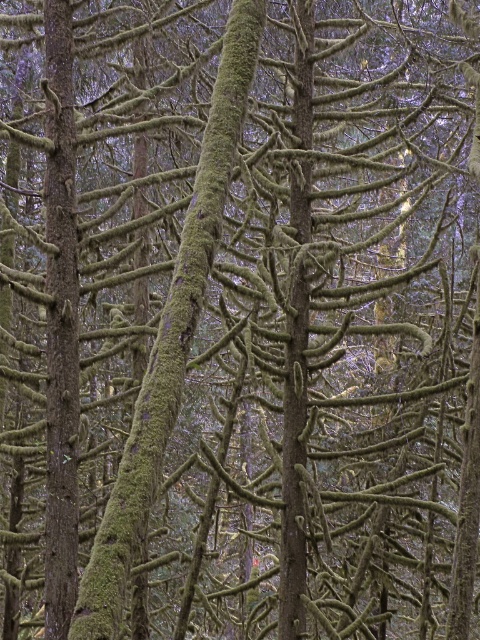
How distant is green mossy tree trunk at center from green mossy tree trunk at left?

A distance of 8.62 feet exists between green mossy tree trunk at center and green mossy tree trunk at left.

Is green mossy tree trunk at center to the right of green mossy tree trunk at left from the viewer's perspective?

Correct, you'll find green mossy tree trunk at center to the right of green mossy tree trunk at left.

Locate an element on the screen. The width and height of the screenshot is (480, 640). green mossy tree trunk at center is located at coordinates (170, 333).